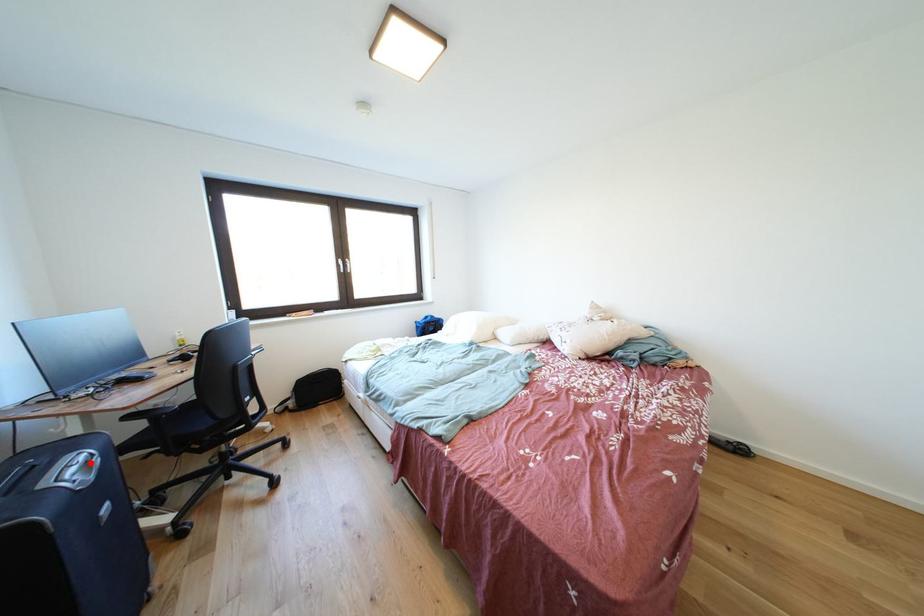
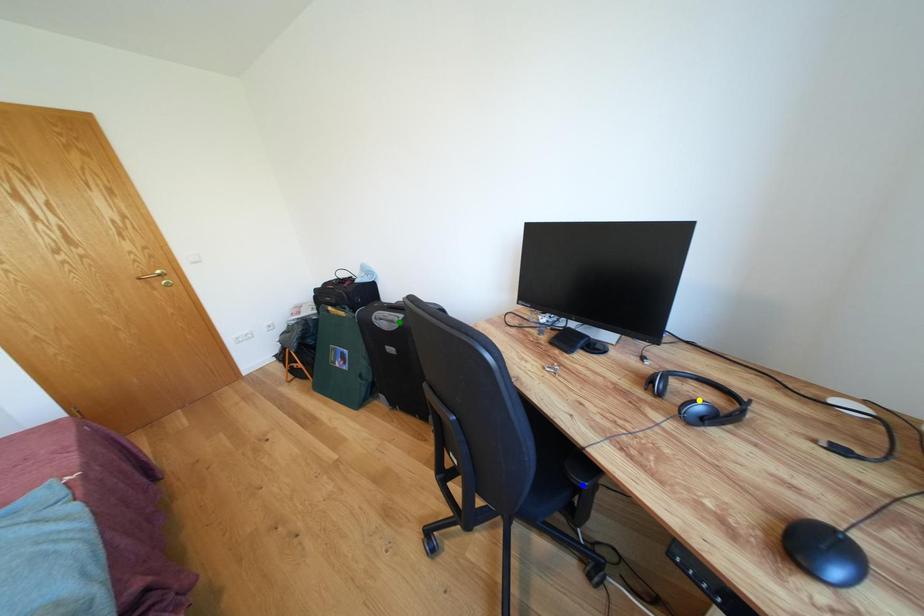
Question: I am providing you with two images of the same scene from different viewpoints. A red point is marked on the first image. You are given multiple points on the second image. In image 2, which mark is for the same physical point as the one in image 1?

Choices:
 (A) yellow point
 (B) green point
 (C) blue point

Answer: (B)